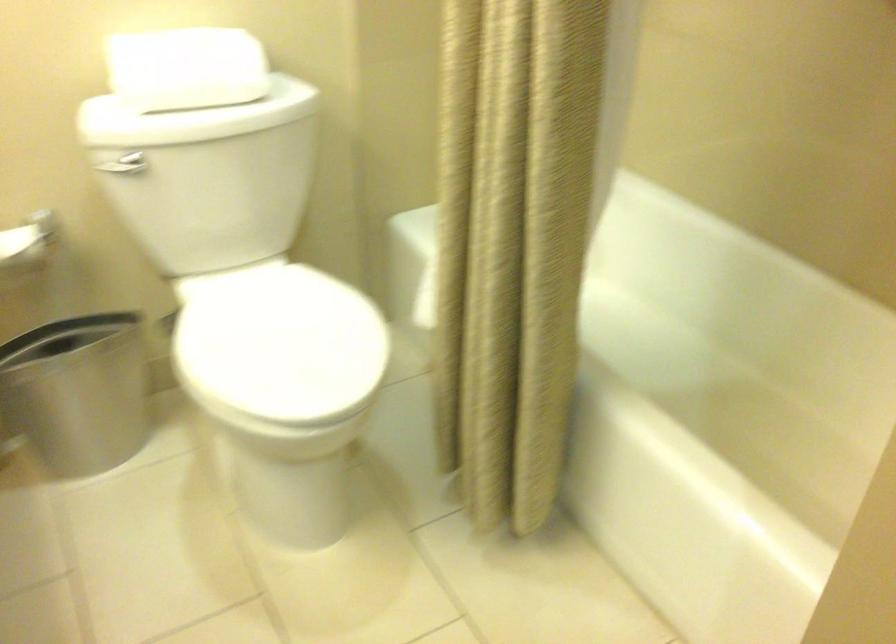
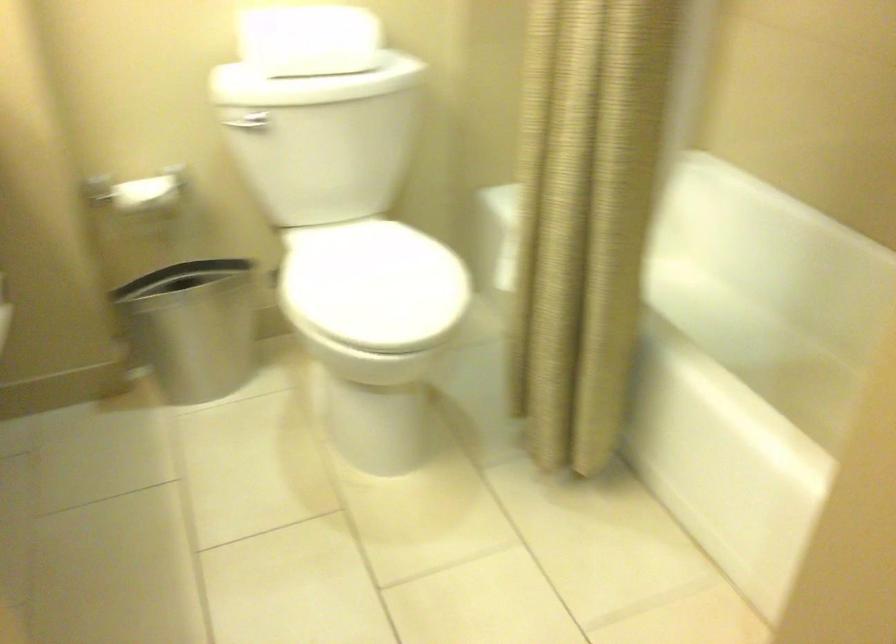
Where in the second image is the point corresponding to point (513, 279) from the first image?

(583, 230)